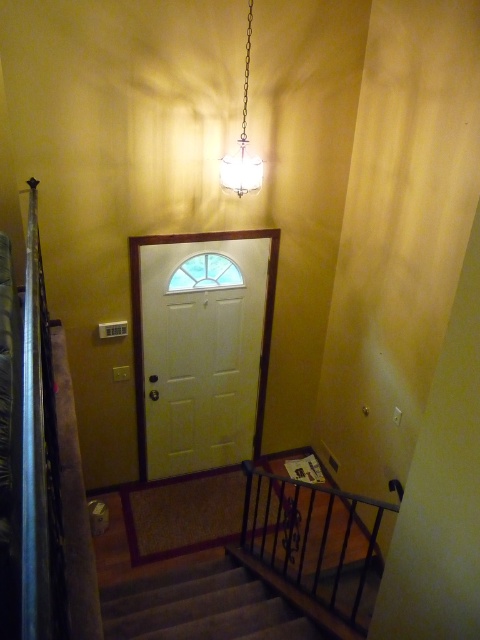
Question: Is white matte door at center bigger than black metal balustrade at lower right?

Choices:
 (A) yes
 (B) no

Answer: (A)

Question: Which object appears closest to the camera in this image?

Choices:
 (A) white matte door at center
 (B) carpeted stairs at center
 (C) white glass chandelier at upper center

Answer: (B)

Question: Which of these objects is positioned closest to the white glass chandelier at upper center?

Choices:
 (A) white matte door at center
 (B) black metal balustrade at lower right

Answer: (A)

Question: Is carpeted stairs at center to the right of white glass chandelier at upper center from the viewer's perspective?

Choices:
 (A) yes
 (B) no

Answer: (B)

Question: Which object is the closest to the black metal balustrade at lower right?

Choices:
 (A) carpeted stairs at center
 (B) white matte door at center
 (C) white glass chandelier at upper center

Answer: (A)

Question: Observing the image, what is the correct spatial positioning of white matte door at center in reference to black metal balustrade at lower right?

Choices:
 (A) above
 (B) below

Answer: (A)